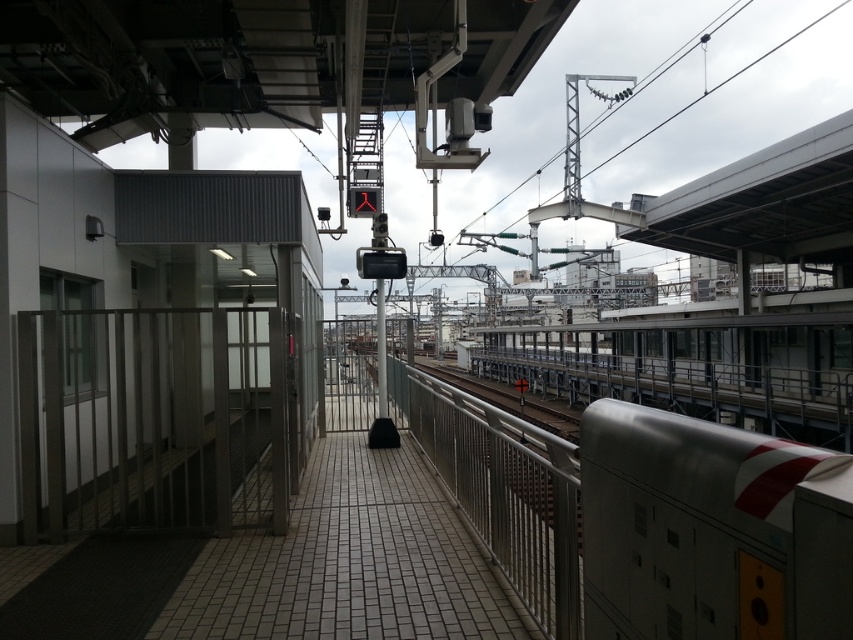
How far apart are metallic gate at left and silver metallic train at right?

The distance of metallic gate at left from silver metallic train at right is 7.23 meters.

Is metallic gate at left shorter than silver metallic train at right?

In fact, metallic gate at left may be taller than silver metallic train at right.

The width and height of the screenshot is (853, 640). Identify the location of metallic gate at left. tap(155, 419).

Is point (24, 356) farther from camera compared to point (529, 492)?

Yes, it is.

Which is in front, point (170, 513) or point (572, 548)?

Point (572, 548)

Find the location of `metallic gate at left`. metallic gate at left is located at coordinates (155, 419).

Is point (714, 554) positioned in front of point (561, 512)?

Yes.

Can you confirm if silver metallic train at right is taller than satin silver rail at center?

In fact, silver metallic train at right may be shorter than satin silver rail at center.

Does point (851, 614) lie behind point (461, 484)?

No.

Identify the location of silver metallic train at right. The width and height of the screenshot is (853, 640). (711, 531).